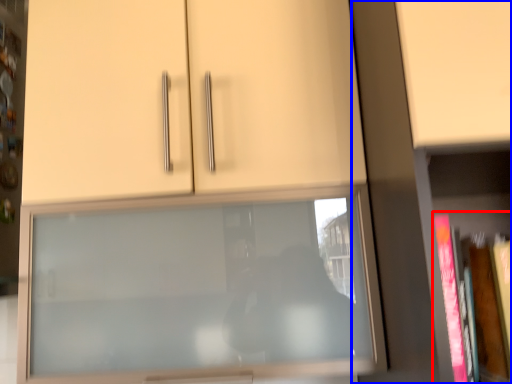
Question: Which of the following is the closest to the observer, book (highlighted by a red box) or bookcase (highlighted by a blue box)?

Choices:
 (A) book
 (B) bookcase

Answer: (B)